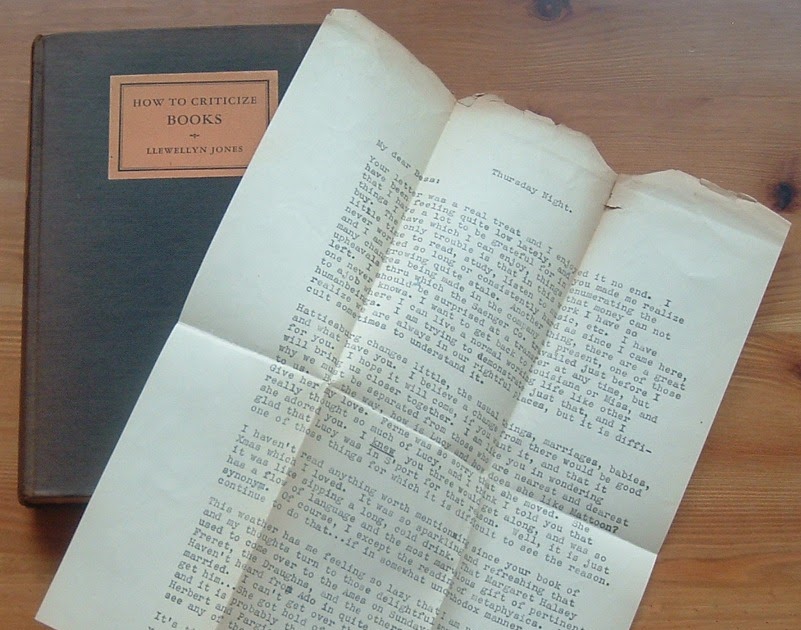
Identify the location of wood grain pattern or discoloration. This screenshot has width=801, height=630. (778, 195), (550, 4).